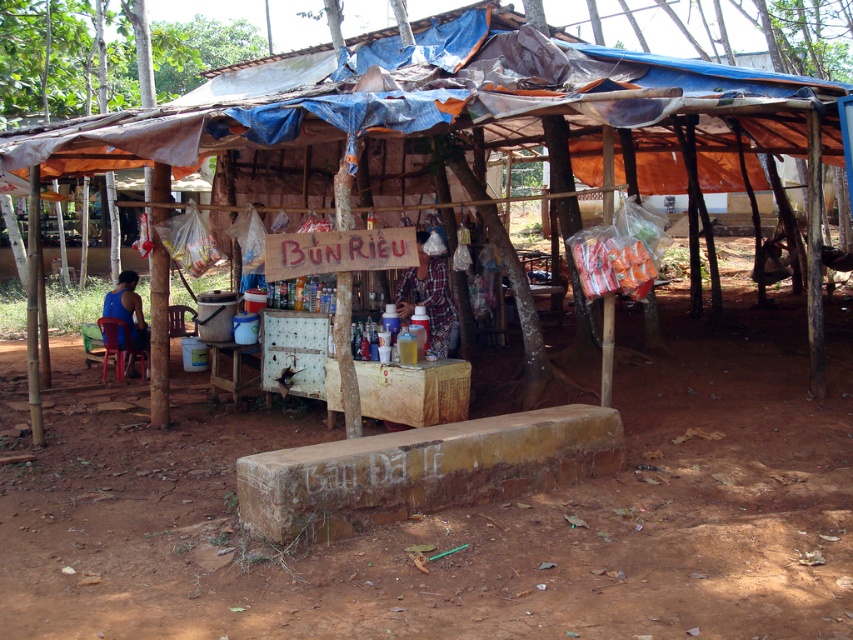
Between brown dirt field at center and wooden shack at center, which one has less height?

brown dirt field at center

From the picture: Who is more distant from viewer, (509,355) or (587,141)?

The point (587,141) is more distant.

Between point (106, 634) and point (685, 84), which one is positioned in front?

Point (106, 634)

This screenshot has height=640, width=853. In order to click on brown dirt field at center in this screenshot , I will do `click(445, 515)`.

Does brown dirt field at center have a smaller size compared to blue fabric shirt at left?

Correct, brown dirt field at center occupies less space than blue fabric shirt at left.

Between brown dirt field at center and blue fabric shirt at left, which one has less height?

brown dirt field at center is shorter.

Who is more distant from viewer, (608, 560) or (138, 339)?

Positioned behind is point (138, 339).

Identify the location of brown dirt field at center. Image resolution: width=853 pixels, height=640 pixels. (445, 515).

Is point (252, 72) farther from viewer compared to point (112, 300)?

That is True.

Is wooden shack at center smaller than blue fabric shirt at left?

Correct, wooden shack at center occupies less space than blue fabric shirt at left.

In order to click on wooden shack at center in this screenshot , I will do `click(457, 115)`.

The width and height of the screenshot is (853, 640). I want to click on wooden shack at center, so click(x=457, y=115).